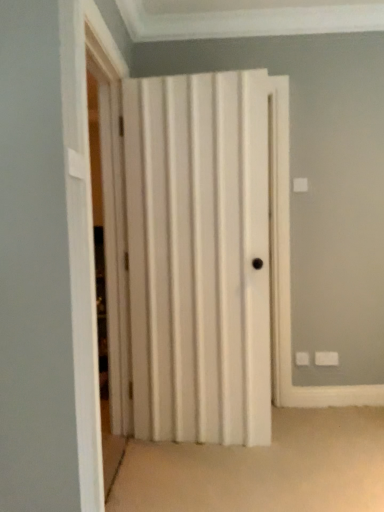
Question: Is white wood folding door at center to the right of white matte door at center from the viewer's perspective?

Choices:
 (A) yes
 (B) no

Answer: (B)

Question: Can we say white wood folding door at center lies outside white matte door at center?

Choices:
 (A) no
 (B) yes

Answer: (B)

Question: From the image's perspective, does white wood folding door at center appear higher than white matte door at center?

Choices:
 (A) no
 (B) yes

Answer: (B)

Question: Would you say white wood folding door at center contains white matte door at center?

Choices:
 (A) yes
 (B) no

Answer: (B)

Question: From the image's perspective, is white wood folding door at center below white matte door at center?

Choices:
 (A) no
 (B) yes

Answer: (A)

Question: Does white wood folding door at center have a larger size compared to white matte door at center?

Choices:
 (A) no
 (B) yes

Answer: (A)

Question: Does white matte door at center have a lesser height compared to white wood folding door at center?

Choices:
 (A) yes
 (B) no

Answer: (A)

Question: Is white matte door at center next to white wood folding door at center?

Choices:
 (A) yes
 (B) no

Answer: (B)

Question: Is white matte door at center aimed at white wood folding door at center?

Choices:
 (A) yes
 (B) no

Answer: (A)

Question: Is white matte door at center behind white wood folding door at center?

Choices:
 (A) no
 (B) yes

Answer: (B)

Question: Is white matte door at center turned away from white wood folding door at center?

Choices:
 (A) no
 (B) yes

Answer: (A)

Question: Does white matte door at center have a lesser width compared to white wood folding door at center?

Choices:
 (A) yes
 (B) no

Answer: (B)

Question: Based on their sizes in the image, would you say white wood folding door at center is bigger or smaller than white matte door at center?

Choices:
 (A) big
 (B) small

Answer: (B)